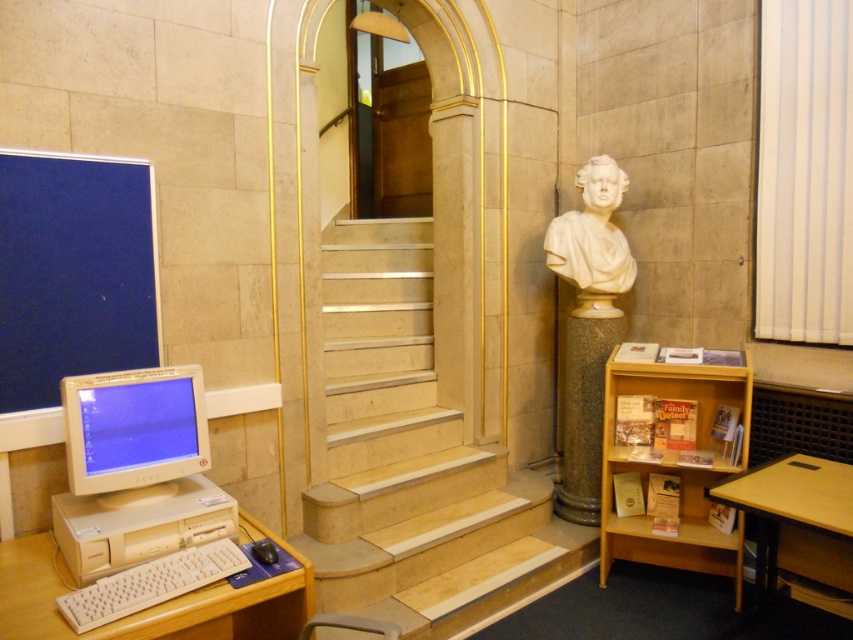
You are a maintenance worker in the library and need to place a new keyboard that is 10 cm wider than the existing white plastic keyboard at lower left. Will the granite column at right have enough space to place this new keyboard next to it?

The granite column at right has a lesser width compared to the white plastic keyboard at lower left. Since the new keyboard is 10 cm wider than the existing one, the granite column at right is narrower than the existing keyboard. Therefore, there might not be enough space to place the new keyboard next to the granite column at right.